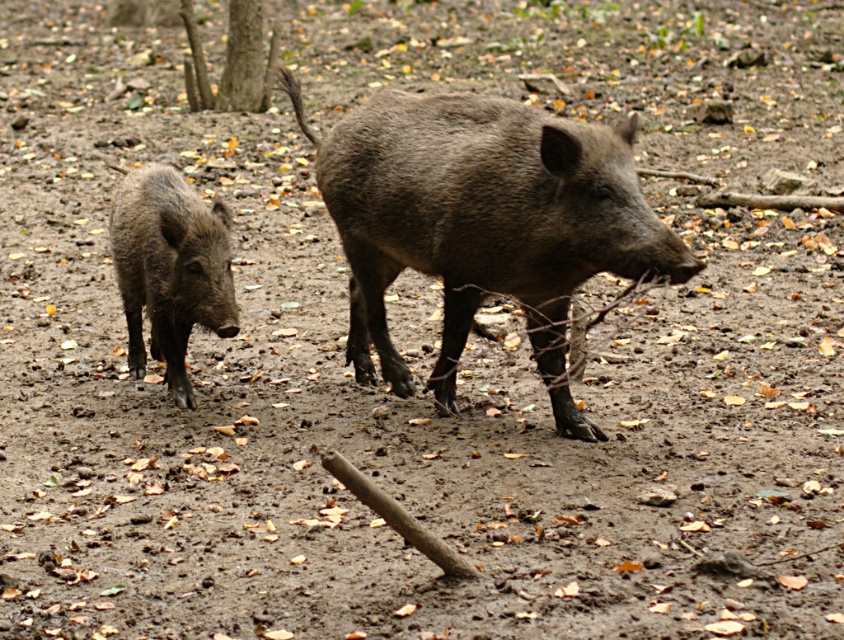
You are a wildlife photographer trying to capture a photo of both the dark brown textured pig at center and the dark brown muddy pig at left. Since you want to include both in the frame, which pig should you focus on first to ensure both are in the shot?

You should focus on the dark brown textured pig at center first because it is larger in size than the dark brown muddy pig at left, so positioning it properly will help frame the smaller pig as well.